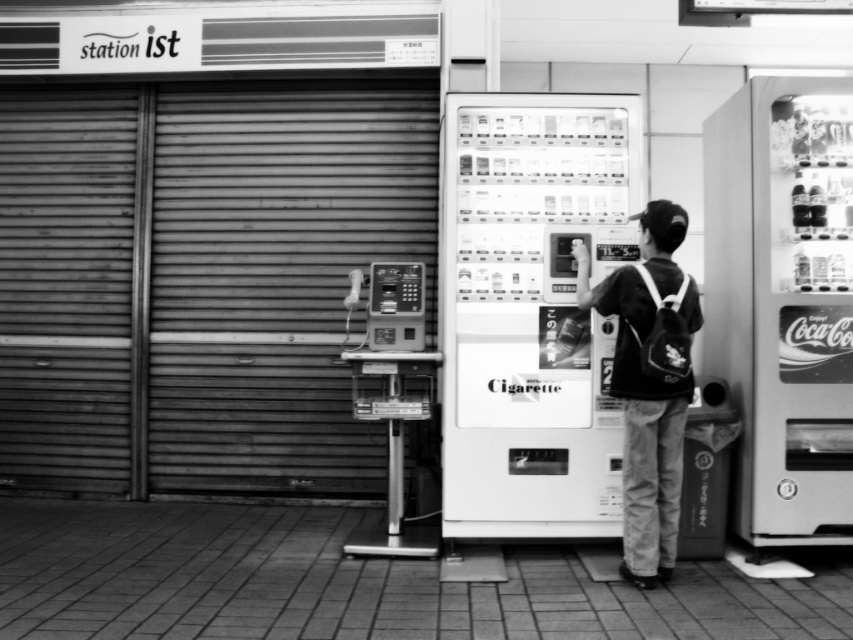
Is the position of metallic gray garage door at left less distant than that of dark fabric backpack at center?

No.

Which of these two, metallic gray garage door at left or dark fabric backpack at center, stands shorter?

Standing shorter between the two is dark fabric backpack at center.

The height and width of the screenshot is (640, 853). Identify the location of metallic gray garage door at left. (200, 276).

From the picture: Is metallic silver vending machine at right below dark fabric backpack at center?

Actually, metallic silver vending machine at right is above dark fabric backpack at center.

Measure the distance between metallic silver vending machine at right and camera.

16.11 feet

Find the location of a particular element. The height and width of the screenshot is (640, 853). metallic silver vending machine at right is located at coordinates (782, 301).

This screenshot has width=853, height=640. Identify the location of metallic silver vending machine at right. (782, 301).

Can you confirm if metallic gray garage door at left is positioned to the right of metallic silver vending machine at right?

No, metallic gray garage door at left is not to the right of metallic silver vending machine at right.

Which is behind, point (39, 108) or point (756, 241)?

Positioned behind is point (39, 108).

Find the location of a particular element. metallic gray garage door at left is located at coordinates (200, 276).